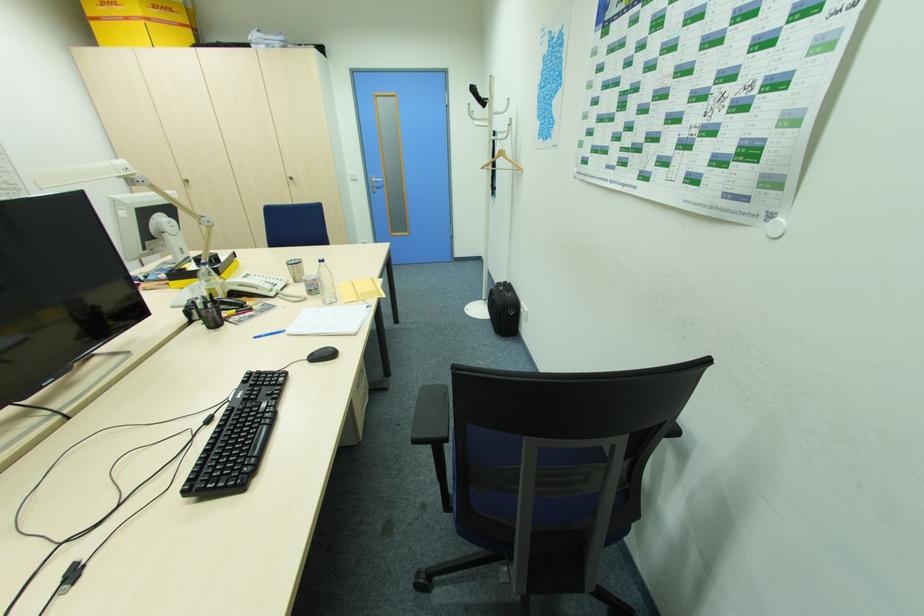
The location [502,161] corresponds to which object?

It refers to a wooden clothes hanger.